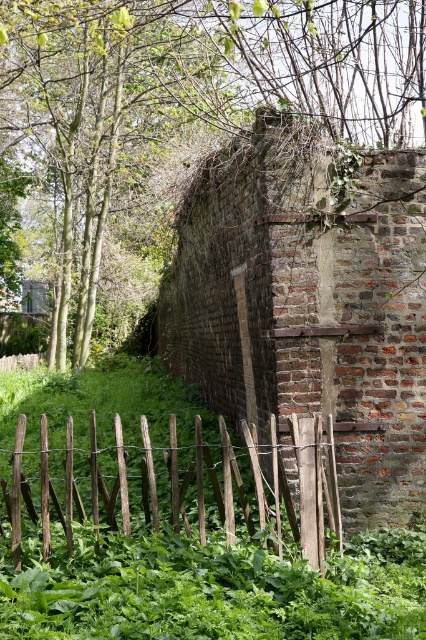
Question: Can you confirm if brick wall at center is positioned above green leafy grass at lower center?

Choices:
 (A) no
 (B) yes

Answer: (B)

Question: Which object is closer to the camera taking this photo?

Choices:
 (A) green leafy tree at upper left
 (B) wooden fence at lower left
 (C) brick wall at center
 (D) green leafy grass at lower center

Answer: (D)

Question: Can you confirm if green leafy tree at upper left is smaller than wooden fence at lower left?

Choices:
 (A) no
 (B) yes

Answer: (A)

Question: Which of these objects is positioned farthest from the wooden fence at lower left?

Choices:
 (A) green leafy grass at lower center
 (B) green leafy tree at upper left
 (C) brick wall at center

Answer: (B)

Question: Where is green leafy tree at upper left located in relation to wooden fence at lower left in the image?

Choices:
 (A) above
 (B) below

Answer: (A)

Question: Estimate the real-world distances between objects in this image. Which object is farther from the brick wall at center?

Choices:
 (A) green leafy tree at upper left
 (B) green leafy grass at lower center

Answer: (A)